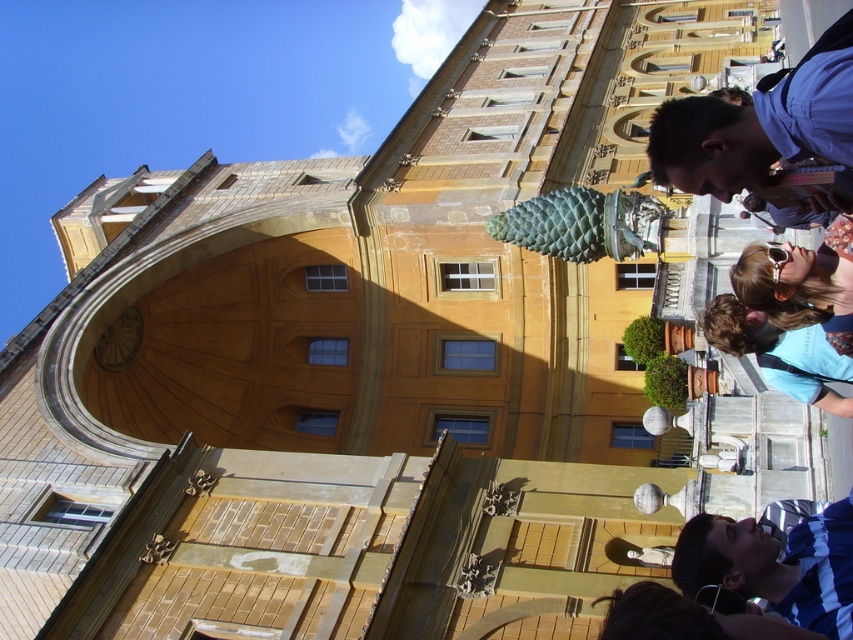
Question: Can you confirm if blue shirt at upper right is thinner than brown hair at lower right?

Choices:
 (A) yes
 (B) no

Answer: (B)

Question: Which point is closer to the camera taking this photo?

Choices:
 (A) (811, 337)
 (B) (775, 264)
 (C) (778, 112)
 (D) (689, 545)

Answer: (C)

Question: Can you confirm if blue shirt at upper right is thinner than matte gold sunglasses at upper right?

Choices:
 (A) yes
 (B) no

Answer: (B)

Question: Where is blue striped shirt at lower right located in relation to brown hair at lower right in the image?

Choices:
 (A) left
 (B) right

Answer: (A)

Question: Which point is closer to the camera?

Choices:
 (A) blue shirt at upper right
 (B) matte gold sunglasses at upper right

Answer: (A)

Question: Which point is closer to the camera?

Choices:
 (A) (772, 568)
 (B) (775, 100)

Answer: (B)